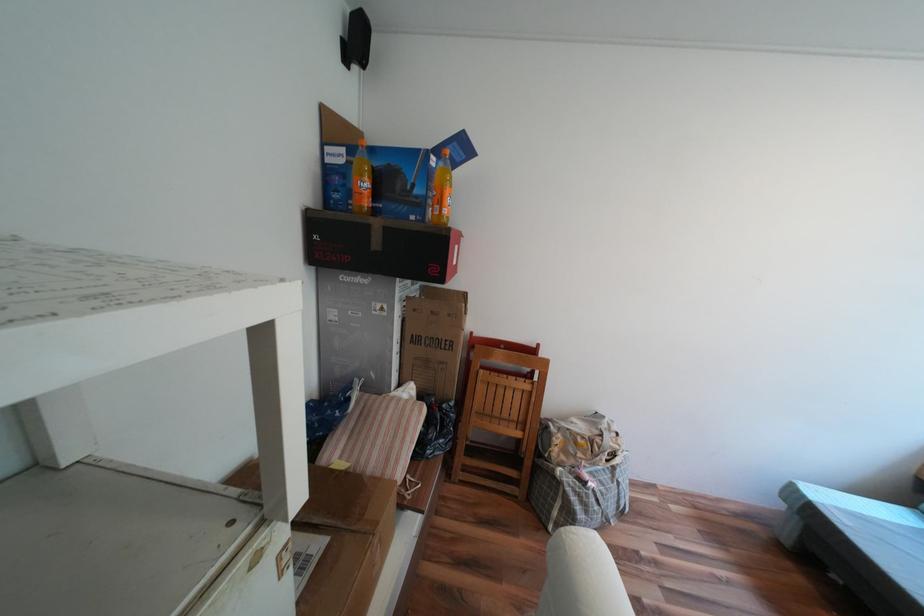
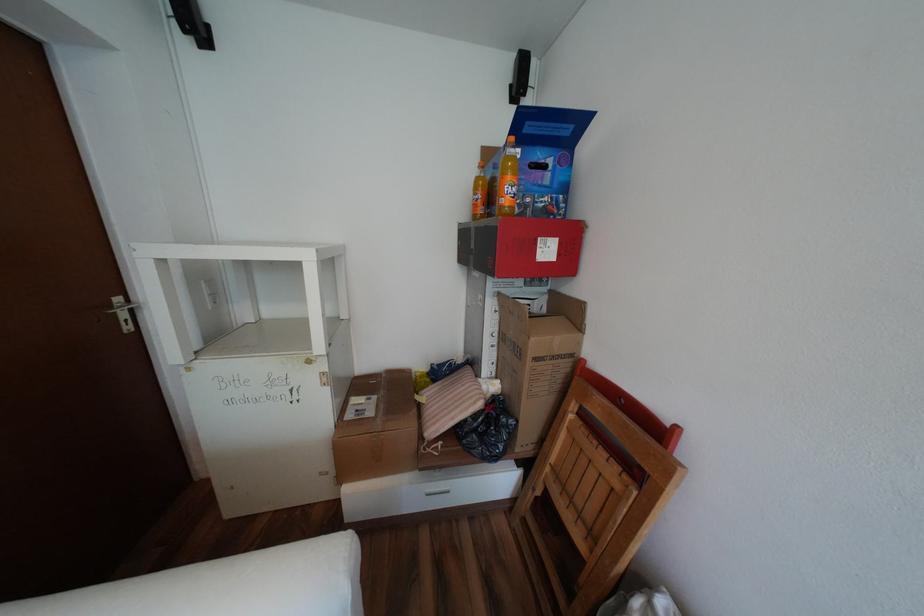
Find the pixel in the second image that matches pixel 465 143 in the first image.

(537, 123)